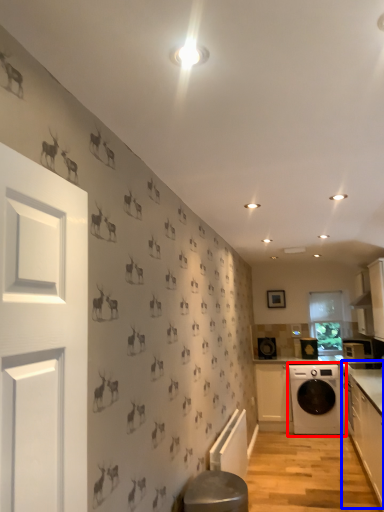
Question: Which object appears closest to the camera in this image, washing machine (highlighted by a red box) or cabinetry (highlighted by a blue box)?

Choices:
 (A) washing machine
 (B) cabinetry

Answer: (B)